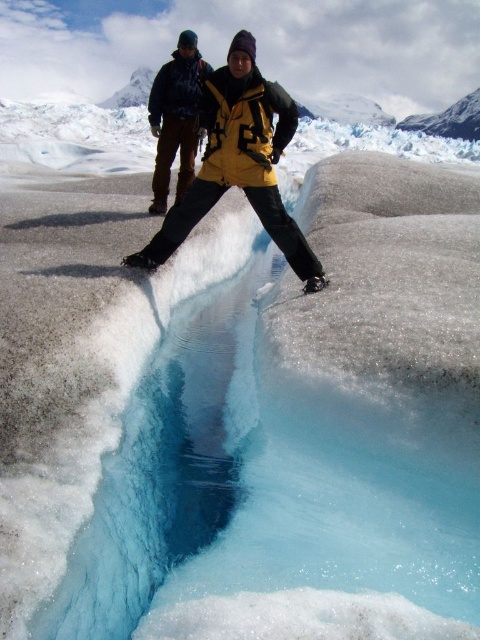
You are a photographer trying to capture both the yellow matte jacket at center and the matte black jacket at center in a single shot. Based on their heights, which jacket will appear larger in the photo?

The yellow matte jacket at center will appear larger in the photo because it has a greater height compared to the matte black jacket at center.

You are planning to take a photo of the yellow matte jacket at center and the dark jacket with brown pants. How far apart should you position them to ensure they are both in focus?

The yellow matte jacket at center and the dark jacket with brown pants are 5.24 meters apart. To ensure both are in focus, position them exactly 5.24 meters apart.

You are a photographer trying to capture both the yellow matte jacket at center and the matte black jacket at center in a single shot. Which jacket will appear larger in the photo?

The yellow matte jacket at center will appear larger in the photo because it is closer to the viewer than the matte black jacket at center.